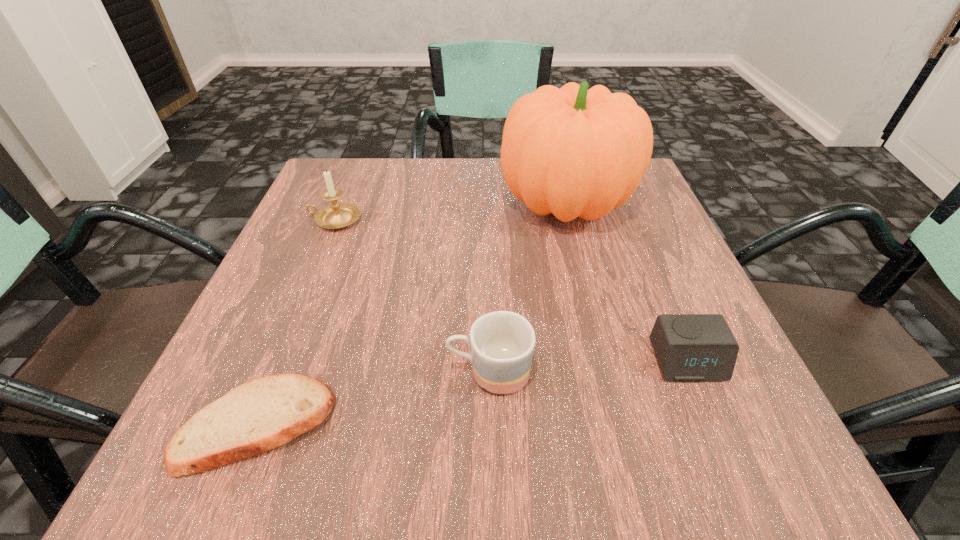
Locate an element on the screen. The height and width of the screenshot is (540, 960). object located at the far right corner is located at coordinates (573, 152).

Image resolution: width=960 pixels, height=540 pixels. Find the location of `free space at the far edge of the desktop`. free space at the far edge of the desktop is located at coordinates (427, 161).

The width and height of the screenshot is (960, 540). I want to click on vacant space at the near edge of the desktop, so click(x=447, y=441).

Where is `blank space at the left edge of the desktop`? This screenshot has width=960, height=540. blank space at the left edge of the desktop is located at coordinates [353, 226].

Locate an element on the screen. vacant space at the right edge of the desktop is located at coordinates (591, 233).

The height and width of the screenshot is (540, 960). In the image, there is a desktop. Identify the location of vacant space at the far left corner. (367, 164).

Find the location of a particular element. The width and height of the screenshot is (960, 540). vacant space at the near left corner of the desktop is located at coordinates (256, 457).

Where is `free point between the second tallest object and the pumpkin`? free point between the second tallest object and the pumpkin is located at coordinates (450, 211).

Where is `vacant region between the tallest object and the third shortest object`? The image size is (960, 540). vacant region between the tallest object and the third shortest object is located at coordinates (527, 287).

Identify the location of unoccupied area between the alarm clock and the candle holder. (511, 291).